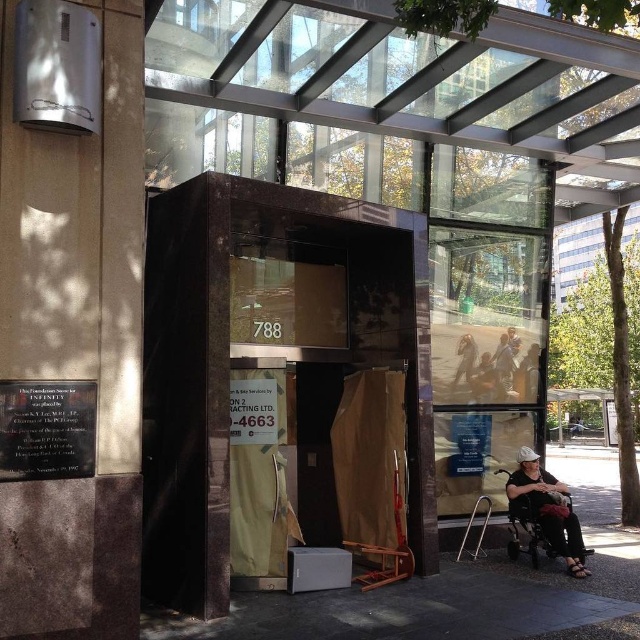
You are a visitor arriving at the building entrance and need to park your wheelchair. There is a designated area near the entrance. The black fabric wheelchair at lower right and the dark blue jeans at center are both in the designated area. Which object takes up more space in the parking area?

The black fabric wheelchair at lower right is larger in size than the dark blue jeans at center, so it takes up more space in the parking area.

You are standing at the entrance of the building and see a person wearing dark blue jeans at center and a black fabric wheelchair at lower right. You need to reach the glass door with the number 788. Which object is closer to the door?

The dark blue jeans at center is closer to the glass door with the number 788 because the black fabric wheelchair at lower right is 1.38 meters away from it.